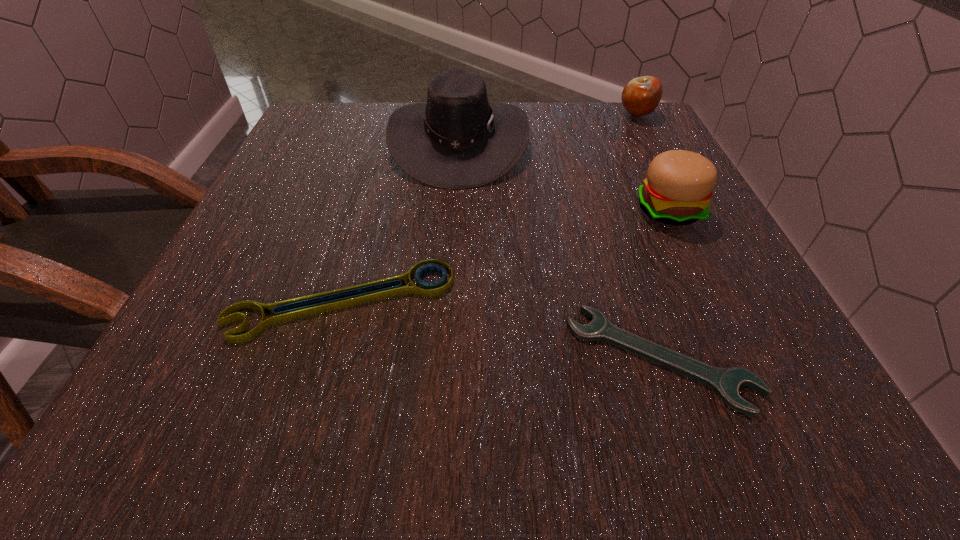
You are a GUI agent. You are given a task and a screenshot of the screen. Output one action in this format:
    pyautogui.click(x=<x>, y=<y>)
    Task: Click on the vacant space situated 0.170m on the back of the right wrench
    
    Given the screenshot: What is the action you would take?
    pyautogui.click(x=618, y=233)

The image size is (960, 540). Identify the location of cowboy hat that is at the far edge. (457, 140).

This screenshot has height=540, width=960. What are the coordinates of `apple at the far edge` in the screenshot? It's located at (641, 96).

I want to click on object that is positioned at the near edge, so click(725, 382).

Locate an element on the screen. Image resolution: width=960 pixels, height=540 pixels. object present at the left edge is located at coordinates (287, 310).

Locate an element on the screen. The image size is (960, 540). hamburger at the right edge is located at coordinates (677, 191).

Find the location of a particular element. Image resolution: width=960 pixels, height=540 pixels. apple that is at the right edge is located at coordinates (641, 96).

Identify the location of wrench situated at the right edge. (725, 382).

I want to click on object at the far right corner, so click(x=641, y=96).

Image resolution: width=960 pixels, height=540 pixels. In order to click on object situated at the near right corner in this screenshot , I will do `click(725, 382)`.